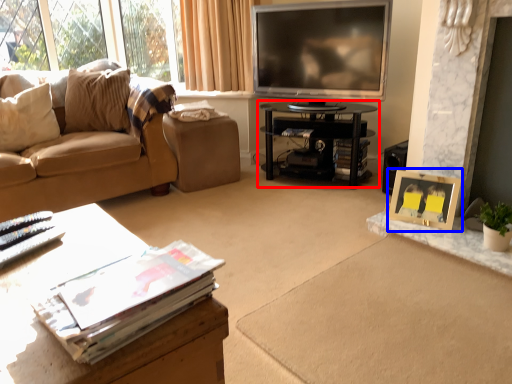
Question: Which object is further to the camera taking this photo, table (highlighted by a red box) or picture frame (highlighted by a blue box)?

Choices:
 (A) table
 (B) picture frame

Answer: (A)